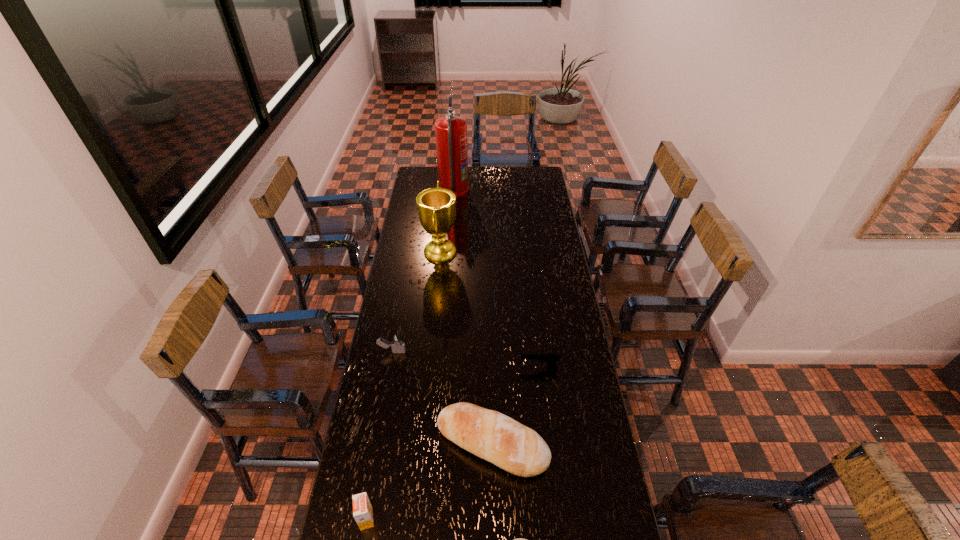
Image resolution: width=960 pixels, height=540 pixels. Identify the location of vacant space situated on the shiny surface of the second tallest object. click(x=535, y=251).

I want to click on blank space located 0.140m on the front of the fifth farthest object, so click(494, 532).

Where is `free region located 0.360m on the right of the second nearest object`? This screenshot has width=960, height=540. free region located 0.360m on the right of the second nearest object is located at coordinates (500, 519).

Locate an element on the screen. The image size is (960, 540). free region located on the right of the igniter is located at coordinates (504, 352).

The height and width of the screenshot is (540, 960). I want to click on blank area located on the front-facing side of the sixth tallest object, so click(x=468, y=367).

The width and height of the screenshot is (960, 540). Find the location of `free space located 0.170m on the front-facing side of the sixth tallest object`. free space located 0.170m on the front-facing side of the sixth tallest object is located at coordinates (474, 367).

Find the location of `free region located on the front-facing side of the sixth tallest object`. free region located on the front-facing side of the sixth tallest object is located at coordinates (506, 367).

This screenshot has height=540, width=960. I want to click on object present at the far edge, so click(x=450, y=131).

Locate an element on the screen. This screenshot has width=960, height=540. fire extinguisher that is at the left edge is located at coordinates (450, 131).

I want to click on award that is at the left edge, so click(x=436, y=206).